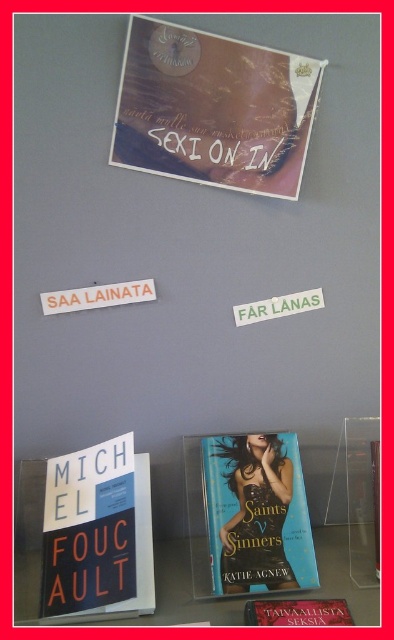
Question: Is teal glossy paperback book at center positioned before blue glossy book at lower center?

Choices:
 (A) yes
 (B) no

Answer: (B)

Question: Is matte brown book cover at upper center positioned in front of blue glossy book at lower center?

Choices:
 (A) yes
 (B) no

Answer: (B)

Question: Does matte brown book cover at upper center appear over blue glossy book at lower center?

Choices:
 (A) no
 (B) yes

Answer: (B)

Question: Which object appears closest to the camera in this image?

Choices:
 (A) matte brown book cover at upper center
 (B) teal glossy paperback book at center

Answer: (B)

Question: Which of the following is the closest to the observer?

Choices:
 (A) blue glossy book at lower center
 (B) matte brown book cover at upper center

Answer: (A)

Question: Considering the real-world distances, which object is closest to the teal glossy paperback book at center?

Choices:
 (A) matte brown book cover at upper center
 (B) blue glossy book at lower center

Answer: (B)